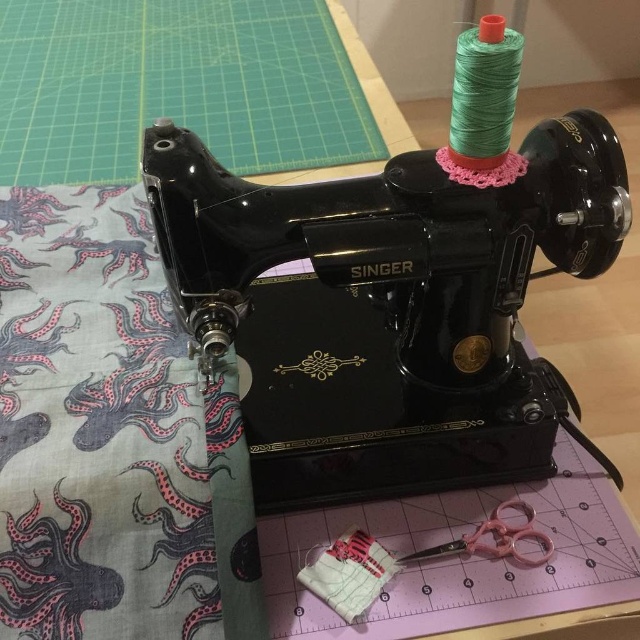
Question: Is black glossy singer sewing machine at center further to the viewer compared to pink plastic scissors at lower center?

Choices:
 (A) no
 (B) yes

Answer: (A)

Question: Which point is farther to the camera?

Choices:
 (A) (502, 532)
 (B) (589, 147)

Answer: (A)

Question: Can you confirm if black glossy singer sewing machine at center is positioned to the left of pink plastic scissors at lower center?

Choices:
 (A) no
 (B) yes

Answer: (B)

Question: Which point appears farthest from the camera in this image?

Choices:
 (A) (589, 224)
 (B) (483, 554)

Answer: (B)

Question: Does black glossy singer sewing machine at center appear on the left side of pink plastic scissors at lower center?

Choices:
 (A) no
 (B) yes

Answer: (B)